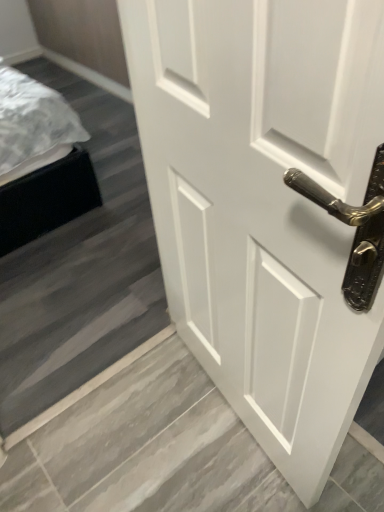
This screenshot has width=384, height=512. What do you see at coordinates (264, 203) in the screenshot? I see `white matte door at center` at bounding box center [264, 203].

In order to face white matte door at center, should I rotate leftwards or rightwards?

Rotate your view right by about 4.772°.

The width and height of the screenshot is (384, 512). I want to click on white matte door at center, so click(x=264, y=203).

This screenshot has width=384, height=512. I want to click on white matte door at center, so click(x=264, y=203).